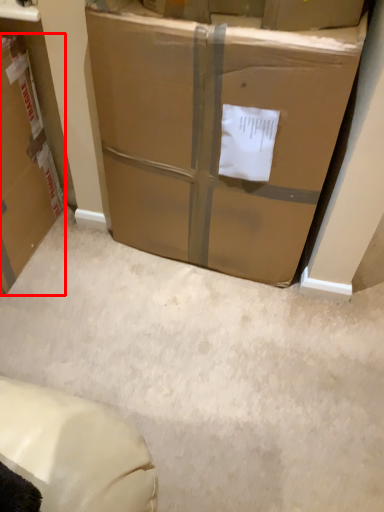
Question: Observing the image, what is the correct spatial positioning of box (annotated by the red box) in reference to box?

Choices:
 (A) left
 (B) right

Answer: (A)